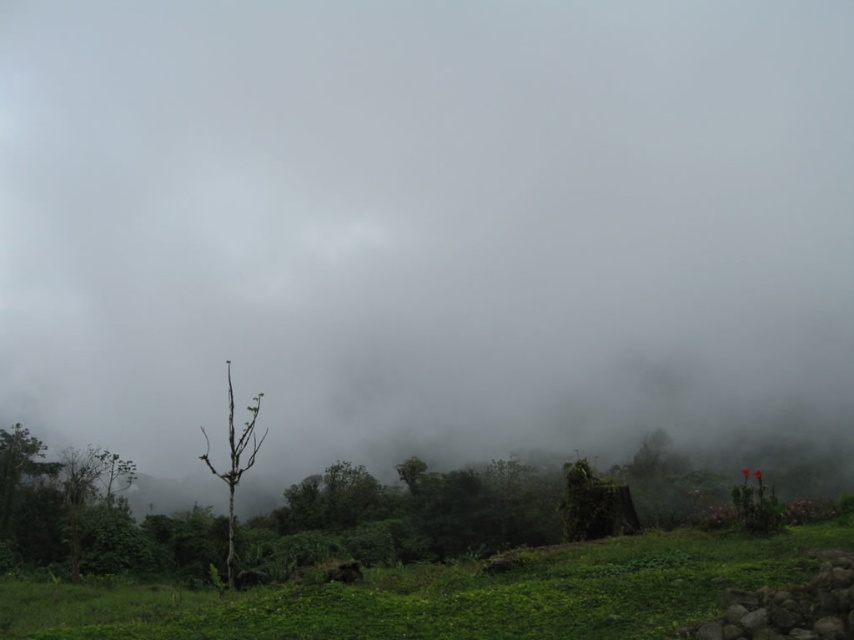
You are a photographer trying to capture the misty landscape. You notice two points in your viewfinder labeled as point (x=591, y=557) and point (x=231, y=467). Which point is nearer to your camera lens?

Point (x=591, y=557) is closer to the camera than point (x=231, y=467), so the photographer should focus on point (x=591, y=557) for a clearer shot.

You are standing in the misty landscape and want to place a small decorative stone exactly at the location of the green leafy grass at lower center. What are the coordinates where you should place the stone?

The green leafy grass at lower center is located at point [447,595], so you should place the stone there.